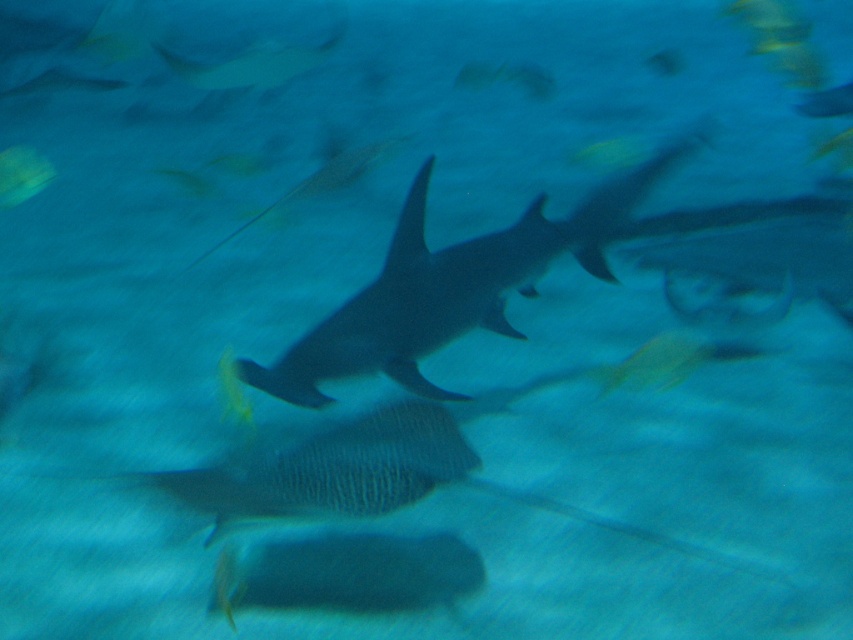
You are a marine biologist studying underwater life. You have a camera with a focus point at coordinates 0.450, 0.530. You want to capture a clear photo of the gray matte shark at center. Can you confirm if the focus point is correctly positioned over the shark?

The gray matte shark at center is located exactly at the focus point coordinates (451, 288), so yes, the focus point is correctly positioned over the shark.

You are a marine biologist observing an underwater scene. You notice the gray matte shark at center and the translucent yellow fish at upper left. Which of these two marine creatures has a larger vertical size in the image?

The gray matte shark at center has a greater height compared to the translucent yellow fish at upper left, so the gray matte shark at center is larger in vertical size.

You are a diver swimming underwater and see two points marked in the scene. Which point is closer to you, point (386, 355) or point (15, 164)?

Point (386, 355) is closer to the viewer than point (15, 164).